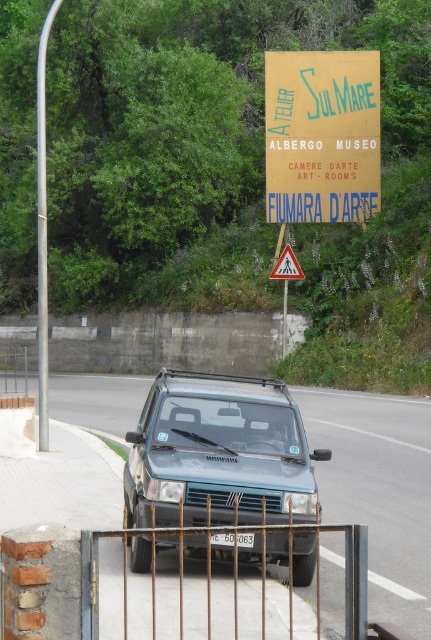
Question: Can you confirm if teal matte suv at center is positioned below black plastic license plate at center?

Choices:
 (A) no
 (B) yes

Answer: (B)

Question: Which point is farther to the camera?

Choices:
 (A) black plastic license plate at center
 (B) wooden signboard at upper center

Answer: (B)

Question: Which point is farther from the camera taking this photo?

Choices:
 (A) (130, 554)
 (B) (293, 204)

Answer: (B)

Question: Which of the following is the farthest from the observer?

Choices:
 (A) yellow triangular warning sign at center
 (B) wooden signboard at upper center
 (C) rusty metal gate at lower center
 (D) black plastic license plate at center

Answer: (B)

Question: Does teal matte suv at center have a lesser width compared to yellow triangular warning sign at center?

Choices:
 (A) no
 (B) yes

Answer: (B)

Question: Does teal matte suv at center have a larger size compared to wooden signboard at upper center?

Choices:
 (A) no
 (B) yes

Answer: (A)